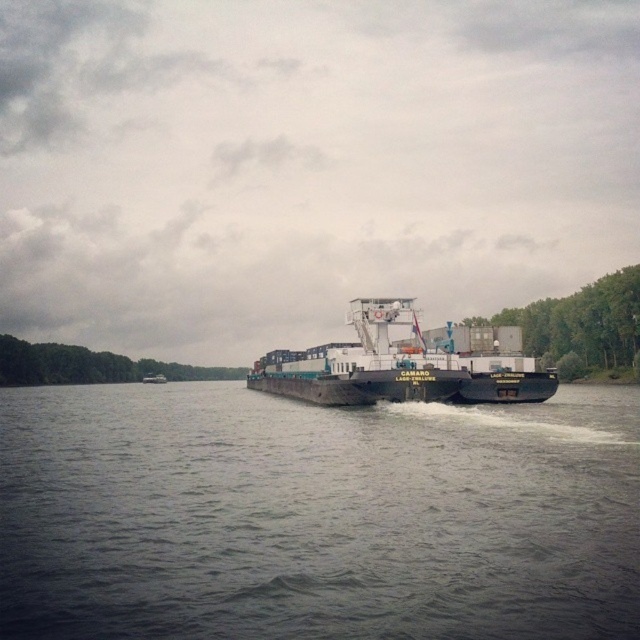
Question: Can you confirm if gray concrete river at center is positioned above white matte cargo ship at center?

Choices:
 (A) yes
 (B) no

Answer: (B)

Question: Which point is closer to the camera taking this photo?

Choices:
 (A) (422, 353)
 (B) (172, 390)

Answer: (A)

Question: Among these objects, which one is farthest from the camera?

Choices:
 (A) gray concrete river at center
 (B) white matte cargo ship at center

Answer: (B)

Question: Does gray concrete river at center appear under white matte cargo ship at center?

Choices:
 (A) no
 (B) yes

Answer: (B)

Question: Where is gray concrete river at center located in relation to white matte cargo ship at center in the image?

Choices:
 (A) below
 (B) above

Answer: (A)